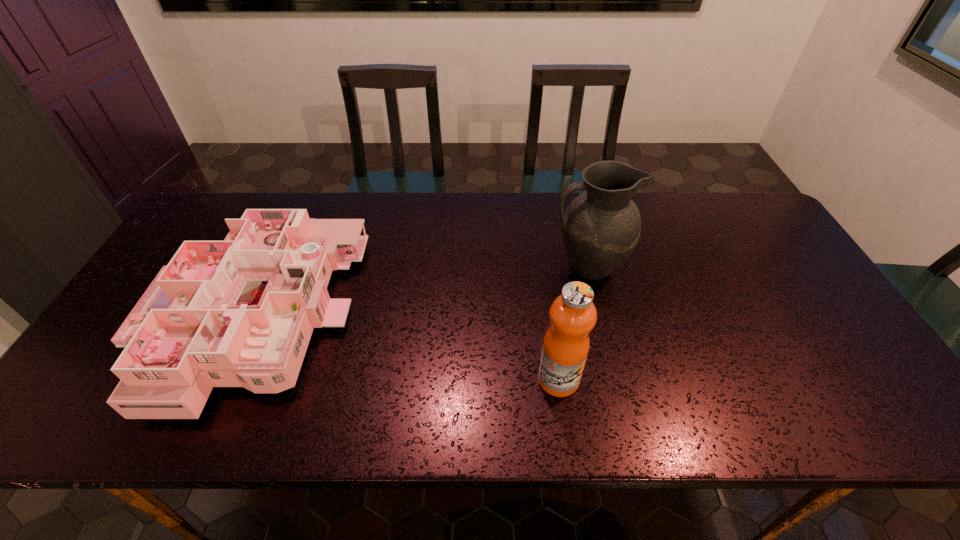
Image resolution: width=960 pixels, height=540 pixels. Find the location of `free space between the dollhouse and the pitcher`. free space between the dollhouse and the pitcher is located at coordinates (419, 293).

Identify the location of vacant point located between the leftmost object and the pitcher. (419, 293).

The height and width of the screenshot is (540, 960). Identify the location of free space that is in between the fruit juice and the leftmost object. (404, 349).

Find the location of `free space between the dollhouse and the pitcher`. free space between the dollhouse and the pitcher is located at coordinates (419, 293).

I want to click on empty space between the shortest object and the fruit juice, so click(404, 349).

Locate which object is the second closest to the fruit juice. Please provide its 2D coordinates. Your answer should be formatted as a tuple, i.e. [(x, y)], where the tuple contains the x and y coordinates of a point satisfying the conditions above.

[(236, 313)]

Find the location of a particular element. The image size is (960, 540). object that stands as the closest to the pitcher is located at coordinates (573, 315).

Image resolution: width=960 pixels, height=540 pixels. Find the location of `vacant space that satisfies the following two spatial constraints: 1. at the front entrance of the fruit juice; 2. on the left side of the dollhouse`. vacant space that satisfies the following two spatial constraints: 1. at the front entrance of the fruit juice; 2. on the left side of the dollhouse is located at coordinates (221, 380).

The image size is (960, 540). I want to click on free space that satisfies the following two spatial constraints: 1. at the front entrance of the fruit juice; 2. on the right side of the leftmost object, so click(221, 380).

You are a GUI agent. You are given a task and a screenshot of the screen. Output one action in this format:
    pyautogui.click(x=<x>, y=<y>)
    Task: Click on the free space that satisfies the following two spatial constraints: 1. at the front entrance of the shortest object; 2. on the back side of the fruit juice
    This screenshot has height=540, width=960.
    Given the screenshot: What is the action you would take?
    pyautogui.click(x=221, y=380)